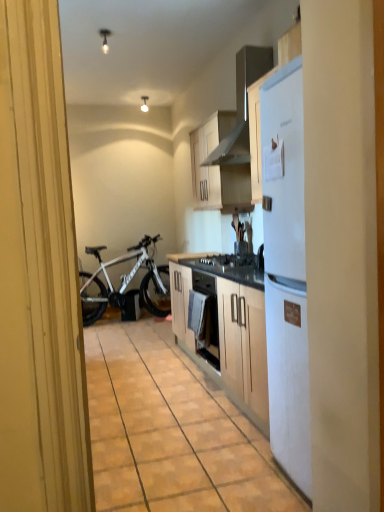
Question: Is the surface of matte wood floor at center in direct contact with white glossy light bulb at upper center, positioned as the 1th lamp in front-to-back order?

Choices:
 (A) no
 (B) yes

Answer: (A)

Question: From a real-world perspective, is matte wood floor at center located higher than white glossy light bulb at upper center, arranged as the second lamp when viewed from the top?

Choices:
 (A) no
 (B) yes

Answer: (A)

Question: Is matte wood floor at center at the left side of white glossy light bulb at upper center, positioned as the 1th lamp in front-to-back order?

Choices:
 (A) no
 (B) yes

Answer: (A)

Question: Can white glossy light bulb at upper center, placed as the first lamp when sorted from bottom to top, be found inside matte wood floor at center?

Choices:
 (A) no
 (B) yes

Answer: (A)

Question: Is matte wood floor at center further to the viewer compared to white glossy light bulb at upper center, the 1th lamp when ordered from left to right?

Choices:
 (A) no
 (B) yes

Answer: (A)

Question: Is matte wood floor at center taller than white glossy light bulb at upper center, the 1th lamp when ordered from left to right?

Choices:
 (A) yes
 (B) no

Answer: (B)

Question: Are white matte bicycle at left and white glossy lamp at upper center, the second lamp in the front-to-back sequence, located far from each other?

Choices:
 (A) yes
 (B) no

Answer: (A)

Question: Is white glossy lamp at upper center, acting as the 2th lamp starting from the bottom, at the back of white matte bicycle at left?

Choices:
 (A) no
 (B) yes

Answer: (A)

Question: Can we say white matte bicycle at left lies outside white glossy lamp at upper center, acting as the 2th lamp starting from the bottom?

Choices:
 (A) yes
 (B) no

Answer: (A)

Question: From a real-world perspective, is white matte bicycle at left on top of white glossy lamp at upper center, acting as the 2th lamp starting from the bottom?

Choices:
 (A) yes
 (B) no

Answer: (B)

Question: Considering the relative sizes of white matte bicycle at left and white glossy lamp at upper center, acting as the 2th lamp starting from the bottom, in the image provided, is white matte bicycle at left thinner than white glossy lamp at upper center, acting as the 2th lamp starting from the bottom,?

Choices:
 (A) yes
 (B) no

Answer: (B)

Question: Is white matte bicycle at left further to camera compared to white glossy lamp at upper center, which ranks as the 2th lamp in left-to-right order?

Choices:
 (A) yes
 (B) no

Answer: (A)

Question: Can you confirm if white glossy lamp at upper center, which ranks as the 2th lamp in left-to-right order, is thinner than matte wood floor at center?

Choices:
 (A) no
 (B) yes

Answer: (B)